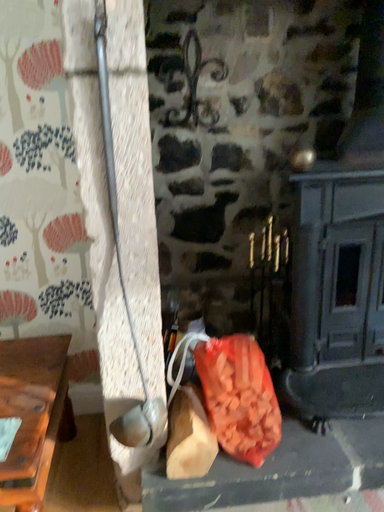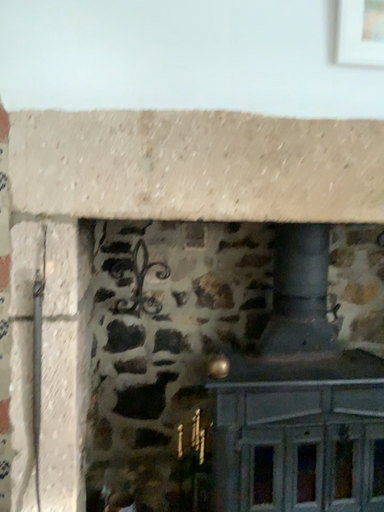
Question: How did the camera likely rotate when shooting the video?

Choices:
 (A) rotated downward
 (B) rotated upward

Answer: (B)